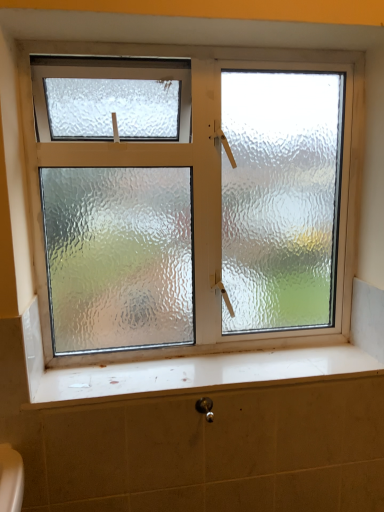
Describe the element at coordinates (205, 408) in the screenshot. This screenshot has width=384, height=512. I see `black metallic shower at lower center` at that location.

What do you see at coordinates (204, 190) in the screenshot?
I see `frosted glass window at center` at bounding box center [204, 190].

Image resolution: width=384 pixels, height=512 pixels. Describe the element at coordinates (190, 372) in the screenshot. I see `white glossy window sill at lower center` at that location.

Find the location of a particular element. black metallic shower at lower center is located at coordinates (x=205, y=408).

The width and height of the screenshot is (384, 512). In order to click on shower that is on the left side of white glossy window sill at lower center in this screenshot , I will do coord(205,408).

Considering the positions of objects white glossy window sill at lower center and black metallic shower at lower center in the image provided, who is more to the left, white glossy window sill at lower center or black metallic shower at lower center?

black metallic shower at lower center.

Is white glossy window sill at lower center closer to camera compared to black metallic shower at lower center?

Yes, white glossy window sill at lower center is closer to the viewer.

Consider the image. Between white glossy window sill at lower center and black metallic shower at lower center, which one has less height?

white glossy window sill at lower center is shorter.

Is frosted glass window at center facing towards white glossy window sill at lower center?

Yes, frosted glass window at center is oriented towards white glossy window sill at lower center.

Measure the distance from frosted glass window at center to white glossy window sill at lower center.

frosted glass window at center is 30.82 centimeters away from white glossy window sill at lower center.

What are the coordinates of `window on the left of white glossy window sill at lower center` in the screenshot? It's located at (204, 190).

How many degrees apart are the facing directions of frosted glass window at center and white glossy window sill at lower center?

The angle between the facing direction of frosted glass window at center and the facing direction of white glossy window sill at lower center is 0.0812 degrees.

Is black metallic shower at lower center a part of frosted glass window at center?

No, black metallic shower at lower center is not inside frosted glass window at center.

Does frosted glass window at center have a lesser width compared to black metallic shower at lower center?

Incorrect, the width of frosted glass window at center is not less than that of black metallic shower at lower center.

Between frosted glass window at center and black metallic shower at lower center, which one has smaller size?

Smaller between the two is black metallic shower at lower center.

Find the location of a particular element. This screenshot has width=384, height=512. shower that is below the frosted glass window at center (from the image's perspective) is located at coordinates (205, 408).

How far apart are black metallic shower at lower center and white glossy window sill at lower center?

black metallic shower at lower center is 9.95 inches away from white glossy window sill at lower center.

From a real-world perspective, is black metallic shower at lower center on top of white glossy window sill at lower center?

No.

Is black metallic shower at lower center aimed at white glossy window sill at lower center?

No, black metallic shower at lower center is not aimed at white glossy window sill at lower center.

Between black metallic shower at lower center and white glossy window sill at lower center, which one has smaller width?

Thinner between the two is black metallic shower at lower center.

Can you confirm if white glossy window sill at lower center is shorter than frosted glass window at center?

Indeed, white glossy window sill at lower center has a lesser height compared to frosted glass window at center.

The image size is (384, 512). Identify the location of window above the white glossy window sill at lower center (from a real-world perspective). (204, 190).

Is white glossy window sill at lower center in front of or behind frosted glass window at center in the image?

white glossy window sill at lower center is in front of frosted glass window at center.

Which of these two, white glossy window sill at lower center or frosted glass window at center, is wider?

With larger width is white glossy window sill at lower center.

Identify the location of shower in front of the frosted glass window at center. The image size is (384, 512). (205, 408).

Between black metallic shower at lower center and frosted glass window at center, which one has smaller size?

Smaller between the two is black metallic shower at lower center.

Can you confirm if black metallic shower at lower center is taller than frosted glass window at center?

Incorrect, the height of black metallic shower at lower center is not larger of that of frosted glass window at center.

Locate an element on the screen. This screenshot has width=384, height=512. shower below the white glossy window sill at lower center (from the image's perspective) is located at coordinates (205, 408).

The height and width of the screenshot is (512, 384). What are the coordinates of `window sill that is on the right side of frosted glass window at center` in the screenshot? It's located at (190, 372).

From the image, which object appears to be nearer to white glossy window sill at lower center, black metallic shower at lower center or frosted glass window at center?

Among the two, black metallic shower at lower center is located nearer to white glossy window sill at lower center.

When comparing their distances from white glossy window sill at lower center, does frosted glass window at center or black metallic shower at lower center seem further?

Among the two, frosted glass window at center is located further to white glossy window sill at lower center.

Based on their spatial positions, is black metallic shower at lower center or white glossy window sill at lower center further from frosted glass window at center?

Among the two, black metallic shower at lower center is located further to frosted glass window at center.

Estimate the real-world distances between objects in this image. Which object is further from black metallic shower at lower center, white glossy window sill at lower center or frosted glass window at center?

Based on the image, frosted glass window at center appears to be further to black metallic shower at lower center.

From the image, which object appears to be farther from frosted glass window at center, white glossy window sill at lower center or black metallic shower at lower center?

black metallic shower at lower center lies further to frosted glass window at center than the other object.

Considering their positions, is frosted glass window at center positioned further to black metallic shower at lower center than white glossy window sill at lower center?

frosted glass window at center.

Where is `window sill that lies between frosted glass window at center and black metallic shower at lower center from top to bottom`? window sill that lies between frosted glass window at center and black metallic shower at lower center from top to bottom is located at coordinates (190, 372).